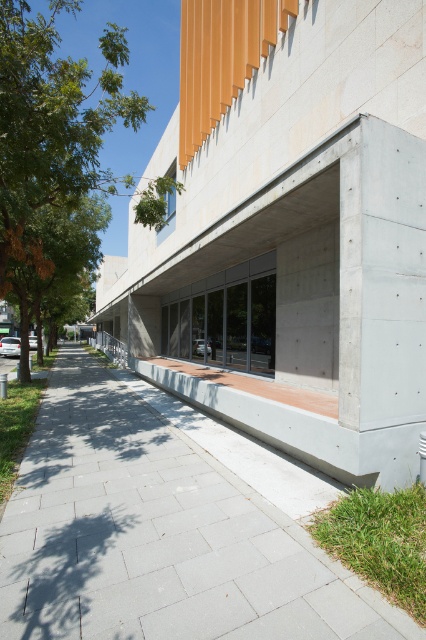
You are standing at the entrance of the building and want to take a photo of the point at coordinates [241,472]. If your camera has a maximum focus range of 5 meters, will you be able to focus on that point?

The distance of point [241,472] from camera is 5.76 meters, which exceeds the camera maximum focus range of 5 meters. Therefore, you will not be able to focus on that point.

You are a visitor approaching the building and notice the gray concrete pavement at center and the green leafy tree at upper left. Which object is casting a shadow over the other?

The green leafy tree at upper left is casting a shadow over the gray concrete pavement at center because the pavement is positioned under the tree.